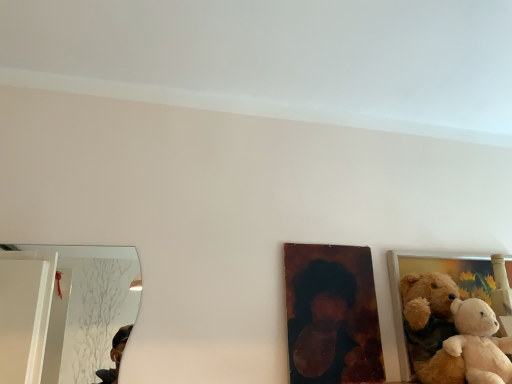
The image size is (512, 384). What do you see at coordinates (400, 295) in the screenshot?
I see `fluffy fabric teddy bear at right, which is the 2th picture frame from left to right` at bounding box center [400, 295].

Consider the image. What is the approximate height of wooden portrait at center, the second picture frame in the right-to-left sequence?

It is 13.45 inches.

At what (x,y) coordinates should I click in order to perform the action: click on soft beige plush at right. Please return your answer as a coordinate pair (x, y). The width and height of the screenshot is (512, 384). Looking at the image, I should click on (471, 349).

From a real-world perspective, is wooden portrait at center, the second picture frame in the right-to-left sequence, above or below fluffy fabric teddy bear at right, which is the 2th picture frame from left to right?

wooden portrait at center, the second picture frame in the right-to-left sequence, is situated higher than fluffy fabric teddy bear at right, which is the 2th picture frame from left to right, in the real world.

Which of these two, wooden portrait at center, the second picture frame in the right-to-left sequence, or fluffy fabric teddy bear at right, which is the 2th picture frame from left to right, is smaller?

wooden portrait at center, the second picture frame in the right-to-left sequence, is smaller.

Consider the image. Is wooden portrait at center, the first picture frame in the left-to-right sequence, facing away from fluffy fabric teddy bear at right, which ranks as the 1th picture frame in right-to-left order?

No.

Between point (292, 374) and point (392, 285), which one is positioned behind?

The point (392, 285) is farther.

Looking at this image, which is less distant, (366, 362) or (464, 340)?

Point (464, 340)

Is wooden portrait at center, the second picture frame in the right-to-left sequence, oriented away from soft beige plush at right?

No, wooden portrait at center, the second picture frame in the right-to-left sequence,'s orientation is not away from soft beige plush at right.

Is wooden portrait at center, the first picture frame in the left-to-right sequence, far from soft beige plush at right?

No, wooden portrait at center, the first picture frame in the left-to-right sequence, is not far from soft beige plush at right.

Who is smaller, wooden portrait at center, the second picture frame in the right-to-left sequence, or soft beige plush at right?

Smaller between the two is wooden portrait at center, the second picture frame in the right-to-left sequence.

Considering the sizes of objects fluffy fabric teddy bear at right, which is the 2th picture frame from left to right, and wooden portrait at center, the first picture frame in the left-to-right sequence, in the image provided, who is taller, fluffy fabric teddy bear at right, which is the 2th picture frame from left to right, or wooden portrait at center, the first picture frame in the left-to-right sequence,?

Standing taller between the two is fluffy fabric teddy bear at right, which is the 2th picture frame from left to right.

Identify the location of picture frame above the fluffy fabric teddy bear at right, which ranks as the 1th picture frame in right-to-left order (from the image's perspective). (332, 315).

Could you measure the distance between fluffy fabric teddy bear at right, which ranks as the 1th picture frame in right-to-left order, and wooden portrait at center, the first picture frame in the left-to-right sequence?

They are 17.25 centimeters apart.

Is there a large distance between fluffy fabric teddy bear at right, which ranks as the 1th picture frame in right-to-left order, and wooden portrait at center, the second picture frame in the right-to-left sequence?

No, fluffy fabric teddy bear at right, which ranks as the 1th picture frame in right-to-left order, is not far from wooden portrait at center, the second picture frame in the right-to-left sequence.

Based on the photo, from a real-world perspective, is fluffy fabric teddy bear at right, which is the 2th picture frame from left to right, over soft beige plush at right?

Indeed, from a real-world perspective, fluffy fabric teddy bear at right, which is the 2th picture frame from left to right, stands above soft beige plush at right.

Does fluffy fabric teddy bear at right, which ranks as the 1th picture frame in right-to-left order, have a lesser width compared to soft beige plush at right?

Correct, the width of fluffy fabric teddy bear at right, which ranks as the 1th picture frame in right-to-left order, is less than that of soft beige plush at right.

Does fluffy fabric teddy bear at right, which ranks as the 1th picture frame in right-to-left order, appear on the right side of soft beige plush at right?

Indeed, fluffy fabric teddy bear at right, which ranks as the 1th picture frame in right-to-left order, is positioned on the right side of soft beige plush at right.

Which of these two, fluffy fabric teddy bear at right, which is the 2th picture frame from left to right, or soft beige plush at right, is bigger?

fluffy fabric teddy bear at right, which is the 2th picture frame from left to right, is bigger.

Is point (485, 358) positioned in front of point (451, 252)?

Yes, it is.

From a real-world perspective, between soft beige plush at right and fluffy fabric teddy bear at right, which ranks as the 1th picture frame in right-to-left order, who is vertically lower?

From a 3D spatial view, soft beige plush at right is below.

Are soft beige plush at right and fluffy fabric teddy bear at right, which is the 2th picture frame from left to right, far apart?

No.

Is soft beige plush at right facing away from wooden portrait at center, the second picture frame in the right-to-left sequence?

soft beige plush at right is not turned away from wooden portrait at center, the second picture frame in the right-to-left sequence.

From a real-world perspective, relative to wooden portrait at center, the first picture frame in the left-to-right sequence, is soft beige plush at right vertically above or below?

From a real-world perspective, soft beige plush at right is physically below wooden portrait at center, the first picture frame in the left-to-right sequence.

Does soft beige plush at right have a lesser width compared to wooden portrait at center, the second picture frame in the right-to-left sequence?

In fact, soft beige plush at right might be wider than wooden portrait at center, the second picture frame in the right-to-left sequence.

Can you confirm if soft beige plush at right is smaller than wooden portrait at center, the second picture frame in the right-to-left sequence?

Incorrect, soft beige plush at right is not smaller in size than wooden portrait at center, the second picture frame in the right-to-left sequence.

Where is `picture frame below the wooden portrait at center, the first picture frame in the left-to-right sequence (from the image's perspective)`? picture frame below the wooden portrait at center, the first picture frame in the left-to-right sequence (from the image's perspective) is located at coordinates (400, 295).

Identify the location of teddy bear on the right of wooden portrait at center, the second picture frame in the right-to-left sequence. (471, 349).

Consider the image. Considering their positions, is soft beige plush at right positioned further to wooden portrait at center, the first picture frame in the left-to-right sequence, than fluffy fabric teddy bear at right, which is the 2th picture frame from left to right?

soft beige plush at right lies further to wooden portrait at center, the first picture frame in the left-to-right sequence, than the other object.

When comparing their distances from wooden portrait at center, the first picture frame in the left-to-right sequence, does fluffy fabric teddy bear at right, which ranks as the 1th picture frame in right-to-left order, or soft beige plush at right seem further?

The object further to wooden portrait at center, the first picture frame in the left-to-right sequence, is soft beige plush at right.

Estimate the real-world distances between objects in this image. Which object is closer to soft beige plush at right, fluffy fabric teddy bear at right, which ranks as the 1th picture frame in right-to-left order, or wooden portrait at center, the first picture frame in the left-to-right sequence?

The object closer to soft beige plush at right is fluffy fabric teddy bear at right, which ranks as the 1th picture frame in right-to-left order.

Which object lies further to the anchor point fluffy fabric teddy bear at right, which ranks as the 1th picture frame in right-to-left order, wooden portrait at center, the second picture frame in the right-to-left sequence, or soft beige plush at right?

soft beige plush at right lies further to fluffy fabric teddy bear at right, which ranks as the 1th picture frame in right-to-left order, than the other object.

Considering their positions, is soft beige plush at right positioned closer to fluffy fabric teddy bear at right, which is the 2th picture frame from left to right, than wooden portrait at center, the first picture frame in the left-to-right sequence?

wooden portrait at center, the first picture frame in the left-to-right sequence, is positioned closer to the anchor fluffy fabric teddy bear at right, which is the 2th picture frame from left to right.

Based on their spatial positions, is wooden portrait at center, the first picture frame in the left-to-right sequence, or fluffy fabric teddy bear at right, which is the 2th picture frame from left to right, closer to soft beige plush at right?

fluffy fabric teddy bear at right, which is the 2th picture frame from left to right, is closer to soft beige plush at right.

Where is `teddy bear between wooden portrait at center, the second picture frame in the right-to-left sequence, and fluffy fabric teddy bear at right, which is the 2th picture frame from left to right`? teddy bear between wooden portrait at center, the second picture frame in the right-to-left sequence, and fluffy fabric teddy bear at right, which is the 2th picture frame from left to right is located at coordinates (471, 349).